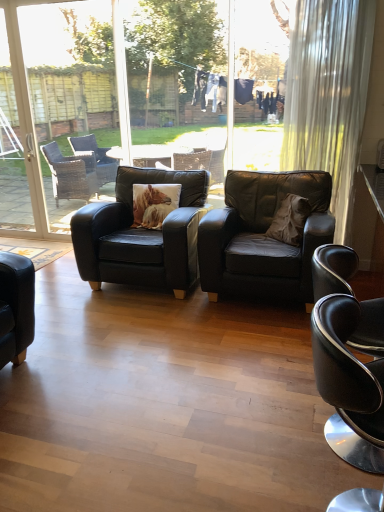
Question: Is matte black armchair at center, placed as the 2th chair when sorted from back to front, not inside white glass screen door at left, which appears as the 2th screen door when viewed from the right?

Choices:
 (A) no
 (B) yes

Answer: (B)

Question: Is matte black armchair at center, placed as the 2th chair when sorted from back to front, positioned before white glass screen door at left, which appears as the 2th screen door when viewed from the right?

Choices:
 (A) yes
 (B) no

Answer: (A)

Question: Can you confirm if matte black armchair at center, the second chair viewed from the front, is positioned to the left of white glass screen door at left, the 1th screen door viewed from the left?

Choices:
 (A) no
 (B) yes

Answer: (A)

Question: Is the depth of matte black armchair at center, the second chair viewed from the front, greater than that of white glass screen door at left, the 1th screen door viewed from the left?

Choices:
 (A) yes
 (B) no

Answer: (B)

Question: Considering the relative sizes of matte black armchair at center, the second chair viewed from the front, and white glass screen door at left, which appears as the 2th screen door when viewed from the right, in the image provided, is matte black armchair at center, the second chair viewed from the front, shorter than white glass screen door at left, which appears as the 2th screen door when viewed from the right,?

Choices:
 (A) yes
 (B) no

Answer: (A)

Question: Does point (342, 130) appear closer or farther from the camera than point (322, 395)?

Choices:
 (A) farther
 (B) closer

Answer: (A)

Question: Would you say white sheer curtain at right is to the left or to the right of black leather chair at lower right, the 1th chair from the front, in the picture?

Choices:
 (A) right
 (B) left

Answer: (A)

Question: Considering their positions, is white sheer curtain at right located in front of or behind black leather chair at lower right, the 1th chair from the front?

Choices:
 (A) front
 (B) behind

Answer: (B)

Question: From the image's perspective, is white sheer curtain at right above or below black leather chair at lower right, the 1th chair from the front?

Choices:
 (A) below
 (B) above

Answer: (B)

Question: Would you say white glass screen door at left, which appears as the 2th screen door when viewed from the right, is inside or outside matte black armchair at center, placed as the 2th chair when sorted from back to front?

Choices:
 (A) inside
 (B) outside

Answer: (B)

Question: Considering the relative positions of white glass screen door at left, the 1th screen door viewed from the left, and matte black armchair at center, the second chair viewed from the front, in the image provided, is white glass screen door at left, the 1th screen door viewed from the left, to the left or to the right of matte black armchair at center, the second chair viewed from the front,?

Choices:
 (A) left
 (B) right

Answer: (A)

Question: Considering the positions of white glass screen door at left, the 1th screen door viewed from the left, and matte black armchair at center, the second chair viewed from the front, in the image, is white glass screen door at left, the 1th screen door viewed from the left, taller or shorter than matte black armchair at center, the second chair viewed from the front,?

Choices:
 (A) short
 (B) tall

Answer: (B)

Question: In terms of width, does white glass screen door at left, the 1th screen door viewed from the left, look wider or thinner when compared to matte black armchair at center, the second chair viewed from the front?

Choices:
 (A) wide
 (B) thin

Answer: (B)

Question: Is white glass screen door at left, which appears as the 2th screen door when viewed from the right, taller or shorter than transparent glass screen door at upper left, which is counted as the second screen door, starting from the left?

Choices:
 (A) short
 (B) tall

Answer: (B)

Question: From a real-world perspective, is white glass screen door at left, the 1th screen door viewed from the left, positioned above or below transparent glass screen door at upper left, which is counted as the first screen door, starting from the right?

Choices:
 (A) above
 (B) below

Answer: (A)